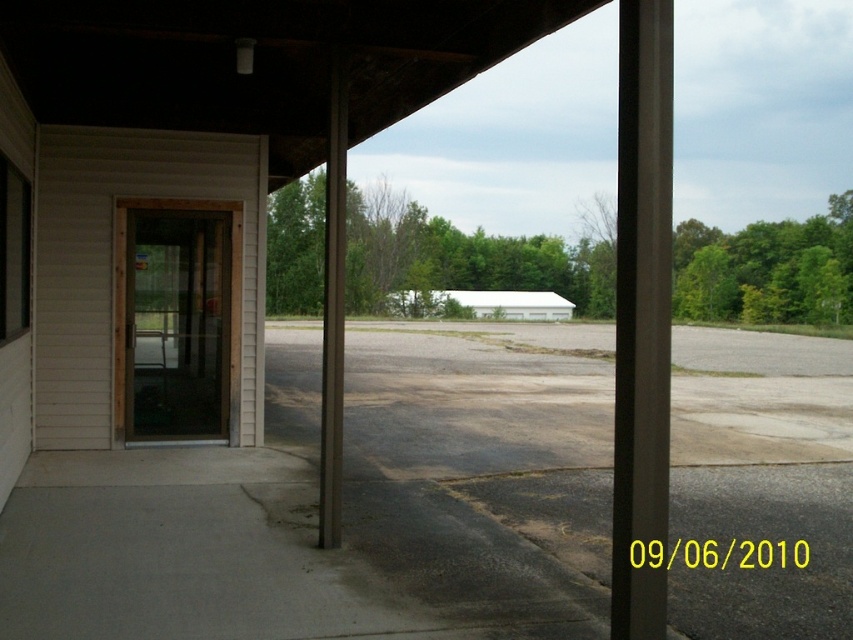
From the picture: Can you confirm if black smooth pole at center is smaller than brown wood pillar at center?

Actually, black smooth pole at center might be larger than brown wood pillar at center.

Who is more distant from viewer, (641, 477) or (337, 483)?

The point (337, 483) is more distant.

Where is `black smooth pole at center`? black smooth pole at center is located at coordinates (641, 317).